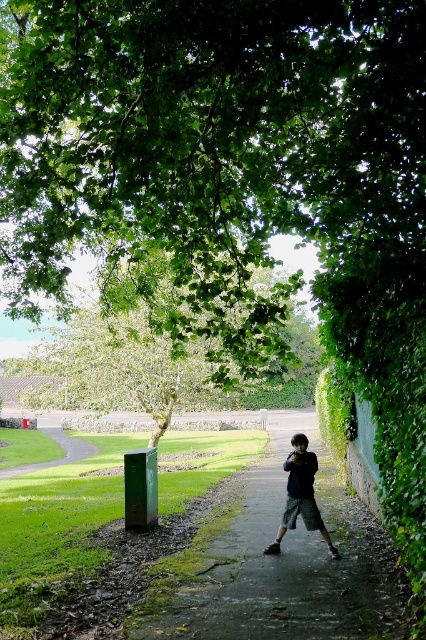
Is smooth concrete pavement at center to the left of dark green textured shorts at center from the viewer's perspective?

No, smooth concrete pavement at center is not to the left of dark green textured shorts at center.

Can you confirm if smooth concrete pavement at center is wider than dark green textured shorts at center?

Yes, smooth concrete pavement at center is wider than dark green textured shorts at center.

Who is more distant from viewer, (249, 604) or (298, 474)?

Point (298, 474)

Where is `smooth concrete pavement at center`? smooth concrete pavement at center is located at coordinates (287, 564).

Does green leafy tree at upper center have a greater width compared to smooth concrete pavement at center?

Yes.

Which is more to the left, green leafy tree at upper center or smooth concrete pavement at center?

From the viewer's perspective, green leafy tree at upper center appears more on the left side.

Does point (207, 51) come behind point (359, 529)?

No, (207, 51) is in front of (359, 529).

You are a GUI agent. You are given a task and a screenshot of the screen. Output one action in this format:
    pyautogui.click(x=<x>, y=<y>)
    Task: Click on the green leafy tree at upper center
    
    Given the screenshot: What is the action you would take?
    pyautogui.click(x=215, y=141)

Where is `green leafy tree at upper center`? green leafy tree at upper center is located at coordinates (215, 141).

Between green leafy tree at upper center and dark green textured shorts at center, which one appears on the left side from the viewer's perspective?

From the viewer's perspective, green leafy tree at upper center appears more on the left side.

Who is more forward, (172, 131) or (305, 488)?

Positioned in front is point (172, 131).

Where is `green leafy tree at upper center`? Image resolution: width=426 pixels, height=640 pixels. green leafy tree at upper center is located at coordinates (215, 141).